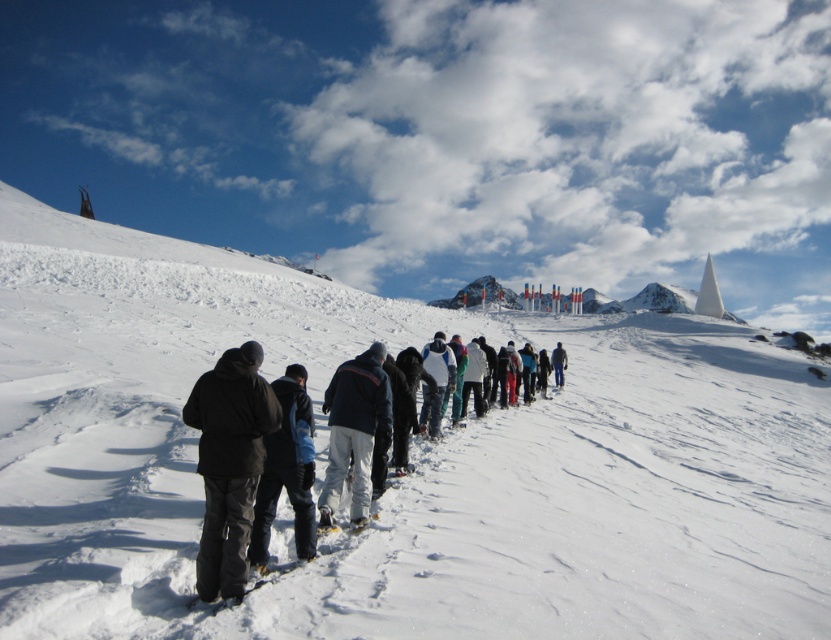
Question: Does white powdery snow at center have a greater width compared to dark gray pants at center?

Choices:
 (A) yes
 (B) no

Answer: (A)

Question: Estimate the real-world distances between objects in this image. Which object is farther from the dark gray pants at center?

Choices:
 (A) white powdery snow at center
 (B) white matte snow pants at center
 (C) black matte jacket at lower left

Answer: (A)

Question: Which point is farther from the camera taking this photo?

Choices:
 (A) (353, 528)
 (B) (514, 589)
 (C) (237, 499)
 (D) (327, 492)

Answer: (D)

Question: Which point is closer to the camera?

Choices:
 (A) (709, 321)
 (B) (323, 488)
 (C) (273, 513)

Answer: (C)

Question: Does white powdery snow at center appear on the right side of white matte snow pants at center?

Choices:
 (A) no
 (B) yes

Answer: (A)

Question: Can you confirm if dark gray pants at center is positioned above black matte jacket at lower left?

Choices:
 (A) no
 (B) yes

Answer: (A)